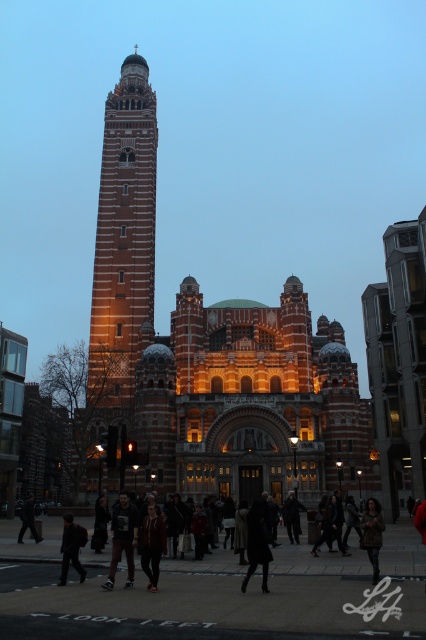
Question: Among these points, which one is farthest from the camera?

Choices:
 (A) (80, 572)
 (B) (28, 499)

Answer: (B)

Question: Does brick tower at center have a smaller size compared to dark brown leather jacket at lower center?

Choices:
 (A) yes
 (B) no

Answer: (B)

Question: Which point appears closest to the camera in this image?

Choices:
 (A) (129, 557)
 (B) (121, 397)
 (C) (155, 540)

Answer: (C)

Question: Considering the relative positions of brick tower at center and dark gray hoodie at center in the image provided, where is brick tower at center located with respect to dark gray hoodie at center?

Choices:
 (A) below
 (B) above

Answer: (B)

Question: Does brick tower at center come in front of dark brown leather coat at center?

Choices:
 (A) no
 (B) yes

Answer: (A)

Question: Which of the following is the farthest from the observer?

Choices:
 (A) camouflage-patterned coat at lower center
 (B) dark brown leather jacket at lower center

Answer: (A)